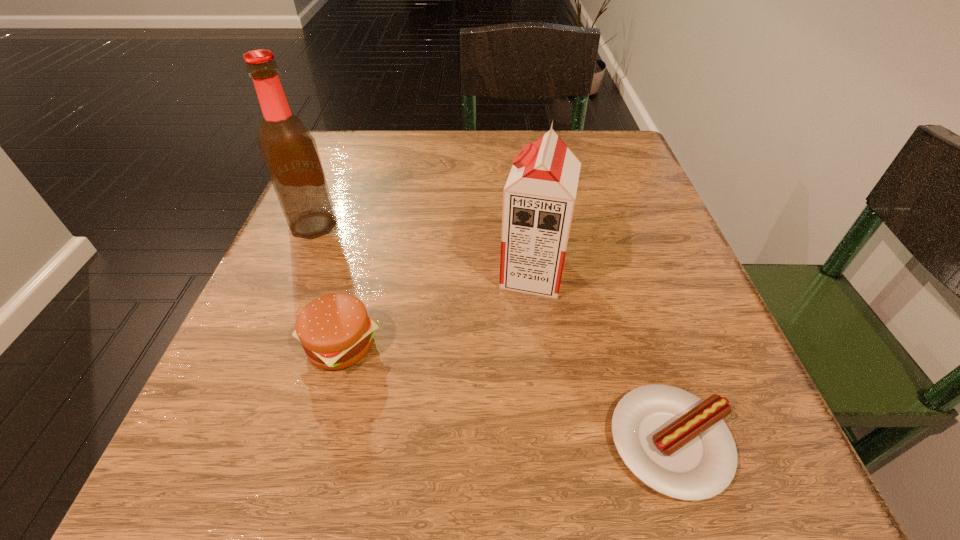
The image size is (960, 540). I want to click on vacant space situated on the back of the third farthest object, so click(x=374, y=221).

In order to click on blank space located 0.170m on the back of the shortest object in this screenshot , I will do `click(624, 292)`.

Where is `object located in the near edge section of the desktop`? object located in the near edge section of the desktop is located at coordinates (677, 444).

The image size is (960, 540). What are the coordinates of `beer bottle that is at the left edge` in the screenshot? It's located at (289, 151).

Locate an element on the screen. hamburger present at the left edge is located at coordinates coord(335,331).

Where is `object at the right edge`? object at the right edge is located at coordinates (677, 444).

Identify the location of object located in the near right corner section of the desktop. Image resolution: width=960 pixels, height=540 pixels. (677, 444).

Identify the location of free region at the far edge of the desktop. (413, 170).

Locate an element on the screen. This screenshot has height=540, width=960. vacant space at the near edge of the desktop is located at coordinates (492, 472).

I want to click on vacant space at the left edge, so click(385, 198).